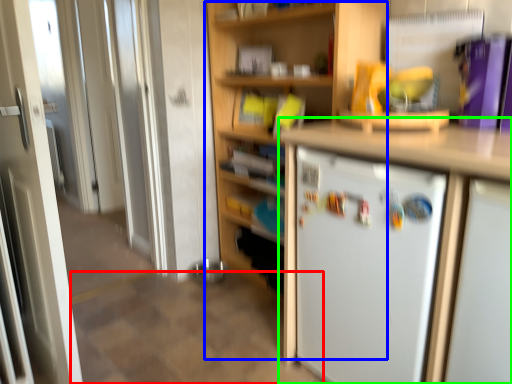
Question: Estimate the real-world distances between objects in this image. Which object is farther from tile (highlighted by a red box), bookshelf (highlighted by a blue box) or cabinetry (highlighted by a green box)?

Choices:
 (A) bookshelf
 (B) cabinetry

Answer: (A)